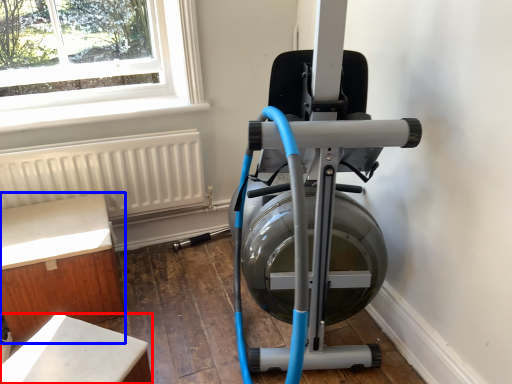
Question: Which of the following is the closest to the observer, furniture (highlighted by a red box) or furniture (highlighted by a blue box)?

Choices:
 (A) furniture
 (B) furniture

Answer: (A)